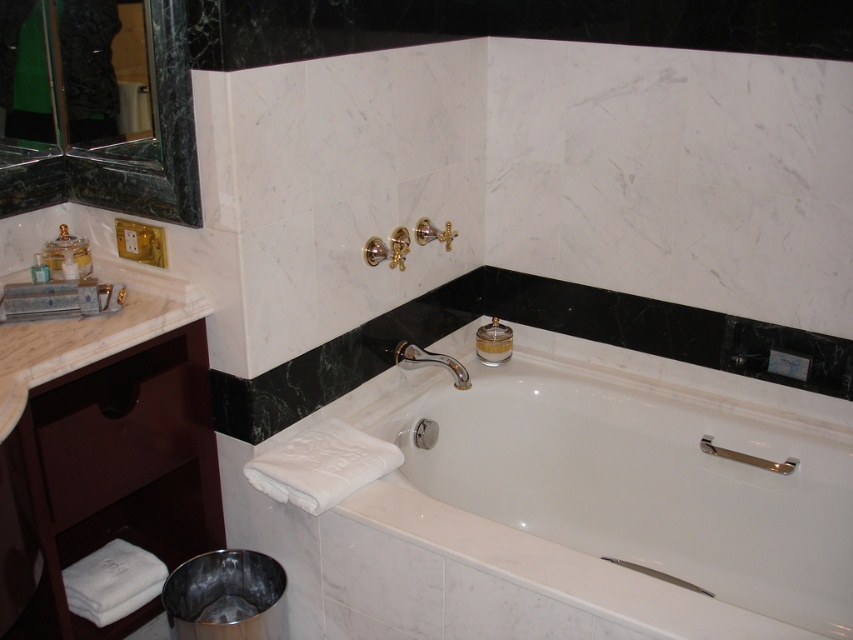
You are standing in the bathroom and want to reach the matte gold soap at left from the white glossy bathtub at center. Which direction should you move to get closer to the soap?

Since the white glossy bathtub at center is further to the viewer than the matte gold soap at left, you should move forward towards the matte gold soap at left to get closer to it.

You are standing in the bathroom and want to reach both points. Which point should you reach first, point (456, 385) or point (62, 268)?

You should reach point (62, 268) first because it is closer to you than point (456, 385), which is further away.